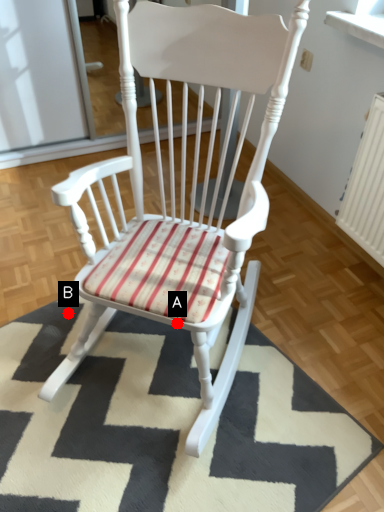
Question: Two points are circled on the image, labeled by A and B beside each circle. Which point is further to the camera?

Choices:
 (A) A is further
 (B) B is further

Answer: (B)